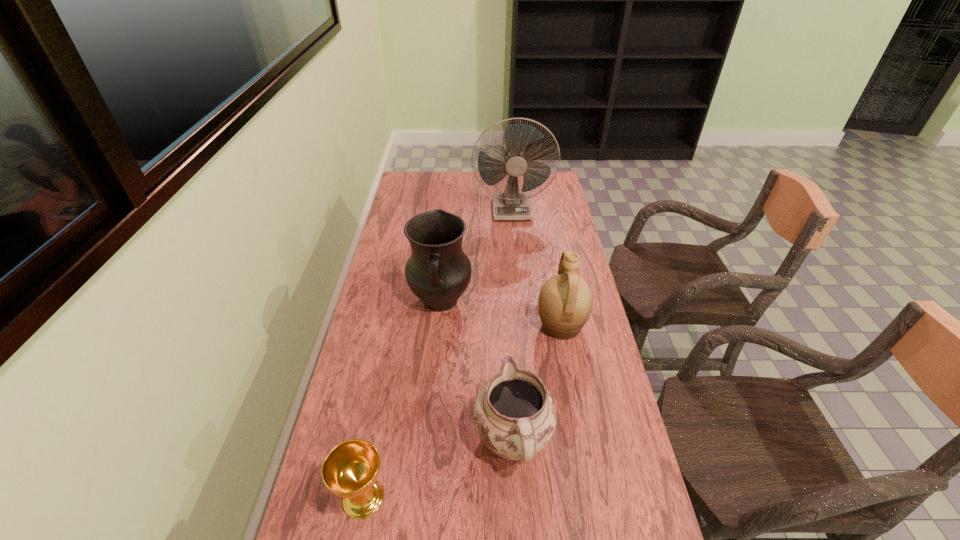
I want to click on vacant region located 0.390m on the spout of the shortest pitcher, so click(x=505, y=300).

The image size is (960, 540). I want to click on vacant space located on the back of the chalice, so click(381, 407).

The height and width of the screenshot is (540, 960). In order to click on pitcher present at the left edge in this screenshot , I will do `click(438, 272)`.

Image resolution: width=960 pixels, height=540 pixels. Identify the location of chalice present at the left edge. (350, 470).

Where is `fan located at the right edge`? The image size is (960, 540). fan located at the right edge is located at coordinates (511, 204).

Locate an element on the screen. The image size is (960, 540). pitcher located in the right edge section of the desktop is located at coordinates (565, 301).

Locate an element on the screen. vacant space at the far edge of the desktop is located at coordinates (466, 179).

Locate an element on the screen. blank space at the left edge of the desktop is located at coordinates (411, 251).

At what (x,y) coordinates should I click in order to perform the action: click on vacant space at the right edge of the desktop. Please return your answer as a coordinate pair (x, y). Image resolution: width=960 pixels, height=540 pixels. Looking at the image, I should click on (575, 249).

I want to click on vacant space that is in between the nearest pitcher and the tallest object, so click(513, 325).